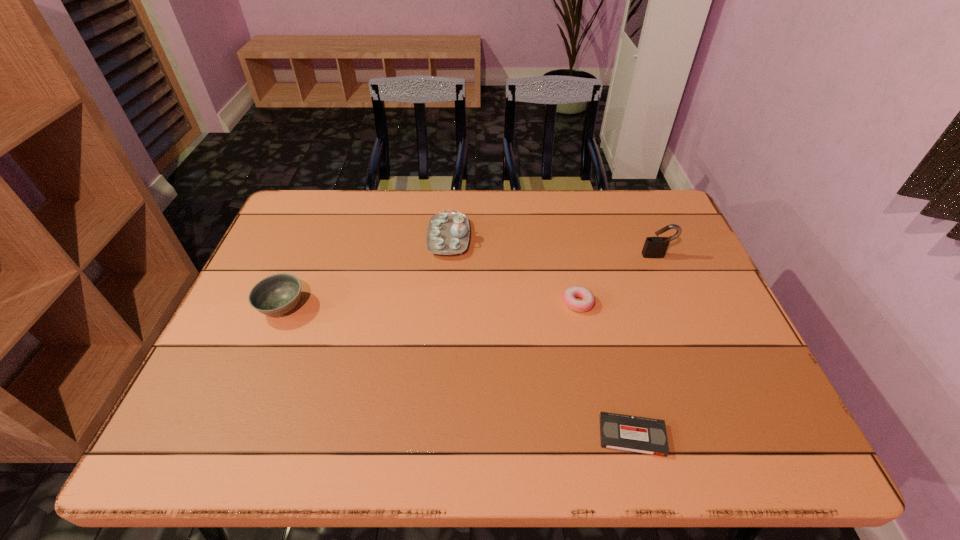
Identify the location of free space at the left edge of the desktop. (281, 346).

Identify the location of free space at the right edge of the desktop. (673, 257).

Where is `free region at the far left corner of the desktop`? The height and width of the screenshot is (540, 960). free region at the far left corner of the desktop is located at coordinates (284, 234).

The image size is (960, 540). I want to click on vacant space at the near left corner of the desktop, so click(x=225, y=420).

The image size is (960, 540). I want to click on free point at the far right corner, so click(x=659, y=226).

At what (x,y) coordinates should I click in order to perform the action: click on free spot at the near right corner of the desktop. Please return your answer as a coordinate pair (x, y). The height and width of the screenshot is (540, 960). Looking at the image, I should click on (760, 436).

You are a GUI agent. You are given a task and a screenshot of the screen. Output one action in this format:
    pyautogui.click(x=<x>, y=<y>)
    Task: Click on the vacant point located between the second tallest object and the bowl
    
    Given the screenshot: What is the action you would take?
    pyautogui.click(x=366, y=272)

The width and height of the screenshot is (960, 540). Identify the location of vacant area between the second shortest object and the fourth shortest object. (513, 271).

This screenshot has height=540, width=960. Find the location of `free space between the tallest object and the third shortest object`. free space between the tallest object and the third shortest object is located at coordinates (469, 281).

Image resolution: width=960 pixels, height=540 pixels. Identify the location of unoccupied area between the chinaware and the videotape. (540, 336).